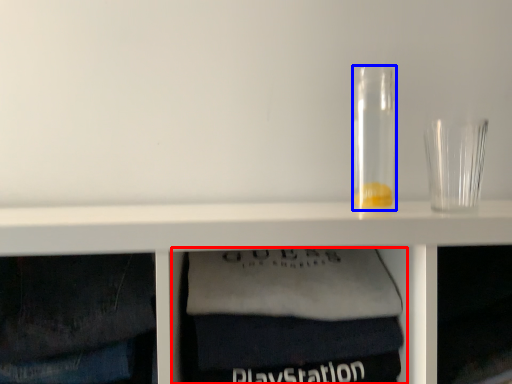
Question: Which point is closer to the camera, cabinet (highlighted by a red box) or glass jar (highlighted by a blue box)?

Choices:
 (A) cabinet
 (B) glass jar

Answer: (A)